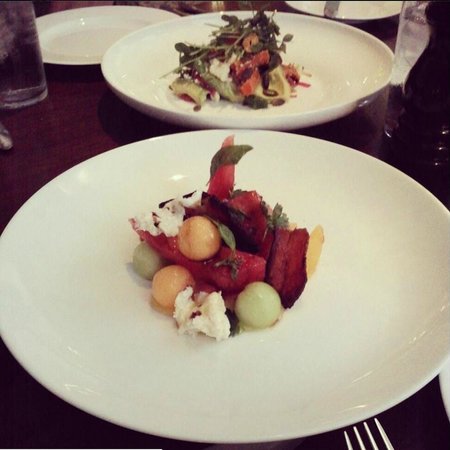
Image resolution: width=450 pixels, height=450 pixels. I want to click on wood table, so click(x=35, y=413), click(x=428, y=437).